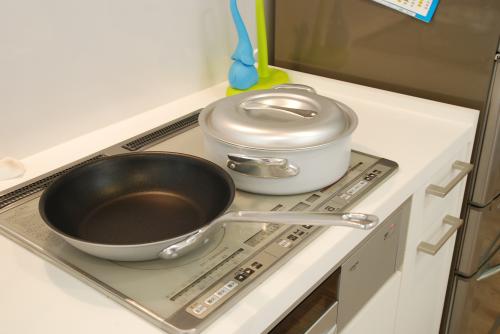
Where is `white cabinets`? white cabinets is located at coordinates (415, 296), (371, 325).